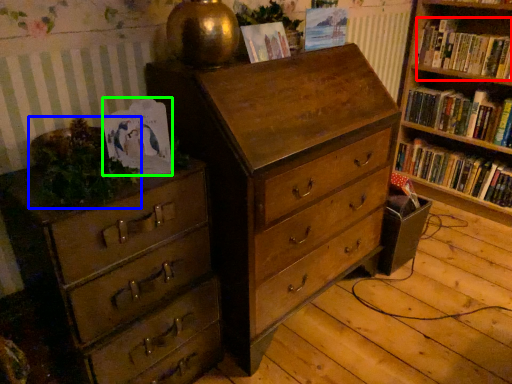
Question: Based on their relative distances, which object is nearer to book (highlighted by a red box)? Choose from plant (highlighted by a blue box) and paperback book (highlighted by a green box).

Choices:
 (A) plant
 (B) paperback book

Answer: (B)